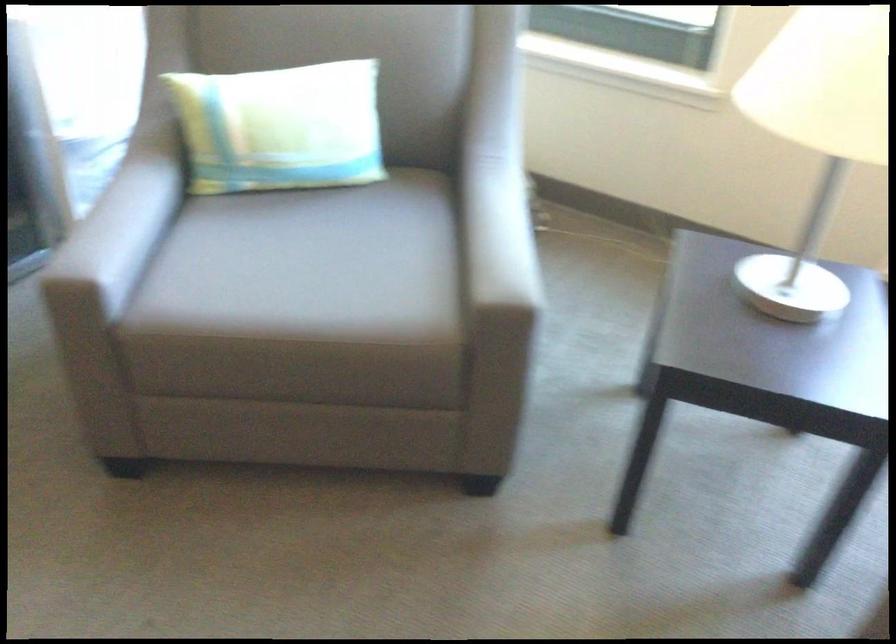
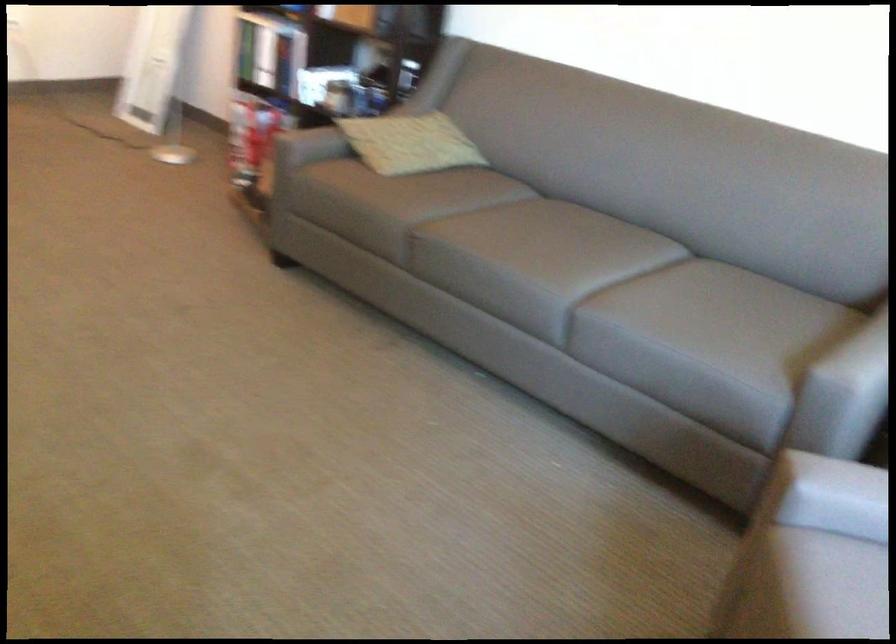
The first image is from the beginning of the video and the second image is from the end. How did the camera likely rotate when shooting the video?

The camera's rotation is toward left-down.